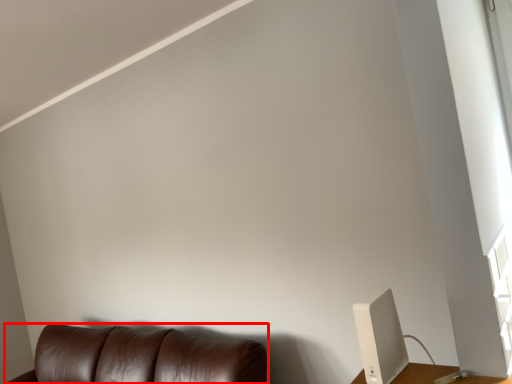
Question: In this image, where is furniture (annotated by the red box) located relative to computer monitor?

Choices:
 (A) left
 (B) right

Answer: (A)